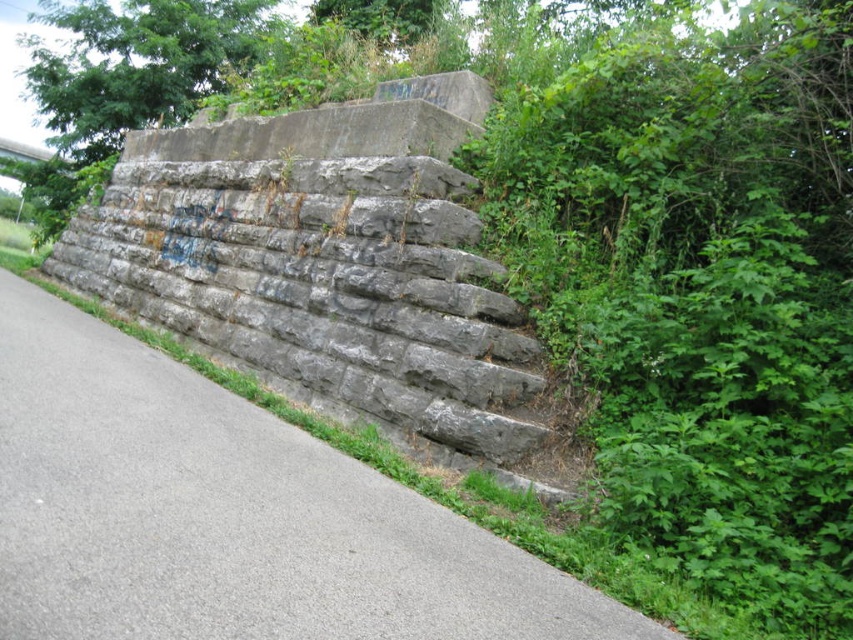
Question: Which point is farther from the camera taking this photo?

Choices:
 (A) (149, 515)
 (B) (386, 108)

Answer: (B)

Question: Is gray stone wall at center positioned in front of gray concrete wall at center?

Choices:
 (A) yes
 (B) no

Answer: (A)

Question: Does gray stone wall at center have a lesser width compared to gray concrete wall at center?

Choices:
 (A) yes
 (B) no

Answer: (B)

Question: Which of the following is the farthest from the observer?

Choices:
 (A) gray concrete wall at center
 (B) gray stone wall at center

Answer: (A)

Question: Can you confirm if gray stone wall at center is positioned to the left of gray concrete wall at center?

Choices:
 (A) no
 (B) yes

Answer: (B)